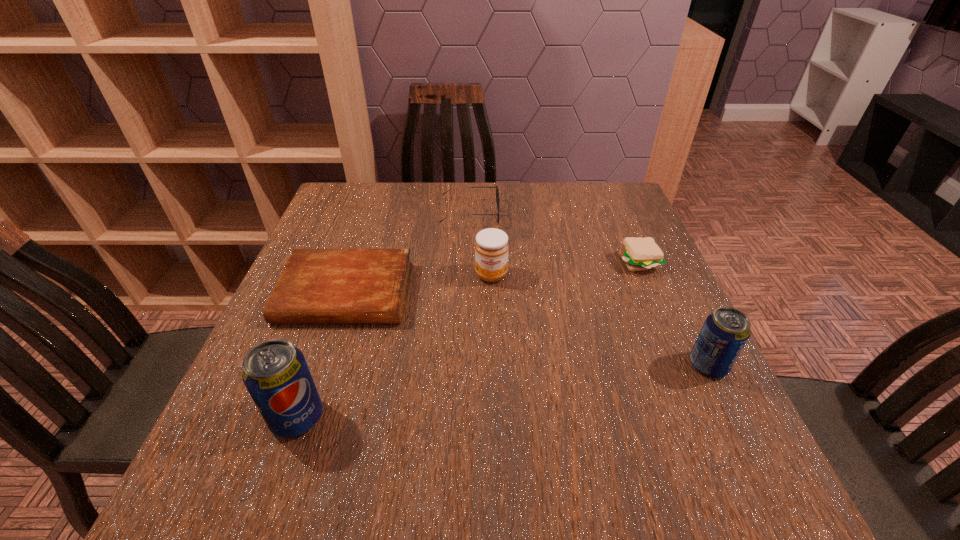
You are a GUI agent. You are given a task and a screenshot of the screen. Output one action in this format:
    pyautogui.click(x=<x>, y=<y>)
    Task: Click on the free space located 0.370m through the lenses of the spectacles
    
    Given the screenshot: What is the action you would take?
    pyautogui.click(x=629, y=213)

You are a GUI agent. You are given a task and a screenshot of the screen. Output one action in this format:
    pyautogui.click(x=<x>, y=<y>)
    Task: Click on the free region located 0.080m on the spine side of the Bible
    
    Given the screenshot: What is the action you would take?
    pyautogui.click(x=324, y=357)

At what (x,y) coordinates should I click in order to perform the action: click on free location located on the left of the patty. Please return your answer as a coordinate pair (x, y). Looking at the image, I should click on pyautogui.click(x=577, y=262).

I want to click on vacant space located 0.260m on the front label of the jam, so click(494, 378).

The image size is (960, 540). In order to click on object present at the far edge in this screenshot , I will do `click(497, 204)`.

This screenshot has height=540, width=960. Find the location of `object that is at the near edge`. object that is at the near edge is located at coordinates (276, 375).

Image resolution: width=960 pixels, height=540 pixels. In order to click on soda situated at the left edge in this screenshot , I will do `click(276, 375)`.

Identify the location of Bible situated at the left edge. The width and height of the screenshot is (960, 540). (317, 286).

Image resolution: width=960 pixels, height=540 pixels. Identify the location of soda that is positioned at the right edge. (725, 332).

You are a GUI agent. You are given a task and a screenshot of the screen. Output one action in this format:
    pyautogui.click(x=<x>, y=<y>)
    Task: Click on the patty located at the right edge
    
    Given the screenshot: What is the action you would take?
    pyautogui.click(x=639, y=254)